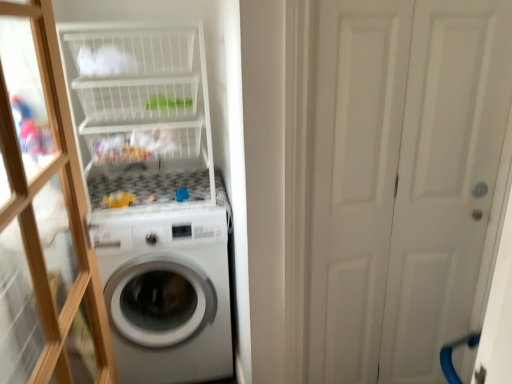
Locate an element on the screen. white matte door at right is located at coordinates (402, 180).

Find the location of a particular element. Image resolution: width=512 pixels, height=384 pixels. white glossy washing machine at center is located at coordinates coord(167,294).

What do you see at coordinates (141, 116) in the screenshot?
I see `white wire basket at upper left` at bounding box center [141, 116].

This screenshot has width=512, height=384. I want to click on white matte door at right, so click(402, 180).

In the scene shown: Does transparent glass door at left have a lesser height compared to white matte door at right?

Yes, transparent glass door at left is shorter than white matte door at right.

From a real-world perspective, is transparent glass door at left positioned above or below white matte door at right?

From a real-world perspective, transparent glass door at left is physically above white matte door at right.

Is transparent glass door at left inside the boundaries of white matte door at right, or outside?

transparent glass door at left is not inside white matte door at right, it's outside.

Is the position of transparent glass door at left less distant than that of white matte door at right?

Yes, it is.

Which is farther from the camera, (167,264) or (23,232)?

The point (167,264) is more distant.

The height and width of the screenshot is (384, 512). I want to click on glass door positioned vertically above the white glossy washing machine at center (from a real-world perspective), so click(x=42, y=218).

Who is shorter, white glossy washing machine at center or transparent glass door at left?

white glossy washing machine at center is shorter.

Is white glossy washing machine at center next to transparent glass door at left and touching it?

white glossy washing machine at center is not next to transparent glass door at left, and they're not touching.

In the scene shown: Is white glossy washing machine at center completely or partially inside white wire basket at upper left?

No, white glossy washing machine at center is not surrounded by white wire basket at upper left.

Looking at their sizes, would you say white wire basket at upper left is wider or thinner than white glossy washing machine at center?

Clearly, white wire basket at upper left has less width compared to white glossy washing machine at center.

Can you tell me how much white wire basket at upper left and white glossy washing machine at center differ in facing direction?

0.125 degrees separate the facing orientations of white wire basket at upper left and white glossy washing machine at center.

Is point (457, 263) farther from camera compared to point (130, 153)?

No, (457, 263) is closer to viewer.

Can you tell me how much white matte door at right and white wire basket at upper left differ in facing direction?

There is a 0.124-degree angle between the facing directions of white matte door at right and white wire basket at upper left.

Is white matte door at right positioned with its back to white wire basket at upper left?

No, white matte door at right is not facing the opposite direction of white wire basket at upper left.

Is white matte door at right wider than white wire basket at upper left?

No.

Is white matte door at right taller than transparent glass door at left?

Correct, white matte door at right is much taller as transparent glass door at left.

Is white matte door at right positioned before transparent glass door at left?

No, white matte door at right is further to the viewer.

Is point (438, 281) closer to camera compared to point (62, 321)?

No, (438, 281) is further to viewer.

Based on the photo, which of these two, white matte door at right or transparent glass door at left, is thinner?

white matte door at right.

Does point (183, 101) appear closer or farther from the camera than point (13, 350)?

Point (183, 101).

Is white wire basket at upper left in contact with transparent glass door at left?

white wire basket at upper left and transparent glass door at left are clearly separated.

Would you say white wire basket at upper left contains transparent glass door at left?

No, white wire basket at upper left does not contain transparent glass door at left.

Considering the sizes of white wire basket at upper left and transparent glass door at left in the image, is white wire basket at upper left taller or shorter than transparent glass door at left?

In the image, white wire basket at upper left appears to be shorter than transparent glass door at left.

Can you confirm if white glossy washing machine at center is positioned to the left of white matte door at right?

Yes.

Is white glossy washing machine at center positioned with its back to white matte door at right?

No, white matte door at right is not at the back of white glossy washing machine at center.

Identify the location of screen door that is above the transparent glass door at left (from the image's perspective). (402, 180).

At what (x,y) coordinates should I click in order to perform the action: click on glass door that is above the white glossy washing machine at center (from a real-world perspective). Please return your answer as a coordinate pair (x, y). Looking at the image, I should click on (42, 218).

Based on their spatial positions, is white glossy washing machine at center or white wire basket at upper left further from transparent glass door at left?

white wire basket at upper left is further to transparent glass door at left.

When comparing their distances from white wire basket at upper left, does white matte door at right or white glossy washing machine at center seem further?

white matte door at right.

Considering their positions, is transparent glass door at left positioned closer to white matte door at right than white wire basket at upper left?

white wire basket at upper left is closer to white matte door at right.

Which object lies further to the anchor point white glossy washing machine at center, white wire basket at upper left or white matte door at right?

white matte door at right is further to white glossy washing machine at center.

Considering their positions, is transparent glass door at left positioned further to white wire basket at upper left than white glossy washing machine at center?

transparent glass door at left is positioned further to the anchor white wire basket at upper left.

Looking at the image, which one is located closer to white wire basket at upper left, transparent glass door at left or white matte door at right?

transparent glass door at left lies closer to white wire basket at upper left than the other object.

Considering their positions, is white wire basket at upper left positioned further to white glossy washing machine at center than transparent glass door at left?

The object further to white glossy washing machine at center is transparent glass door at left.

In the scene shown: Which object lies further to the anchor point white glossy washing machine at center, white matte door at right or white wire basket at upper left?

Based on the image, white matte door at right appears to be further to white glossy washing machine at center.

Image resolution: width=512 pixels, height=384 pixels. Find the location of `screen door between transparent glass door at left and white glossy washing machine at center in the front-back direction`. screen door between transparent glass door at left and white glossy washing machine at center in the front-back direction is located at coordinates (402, 180).

Where is `screen door between transparent glass door at left and white wire basket at upper left from front to back`? screen door between transparent glass door at left and white wire basket at upper left from front to back is located at coordinates (402, 180).

You are a GUI agent. You are given a task and a screenshot of the screen. Output one action in this format:
    pyautogui.click(x=<x>, y=<y>)
    Task: Click on the shelf between transparent glass door at left and white glossy washing machine at center in the front-back direction
    
    Given the screenshot: What is the action you would take?
    pyautogui.click(x=141, y=116)

Where is `washing machine between white wire basket at upper left and white matte door at right from left to right`? This screenshot has height=384, width=512. washing machine between white wire basket at upper left and white matte door at right from left to right is located at coordinates (167, 294).